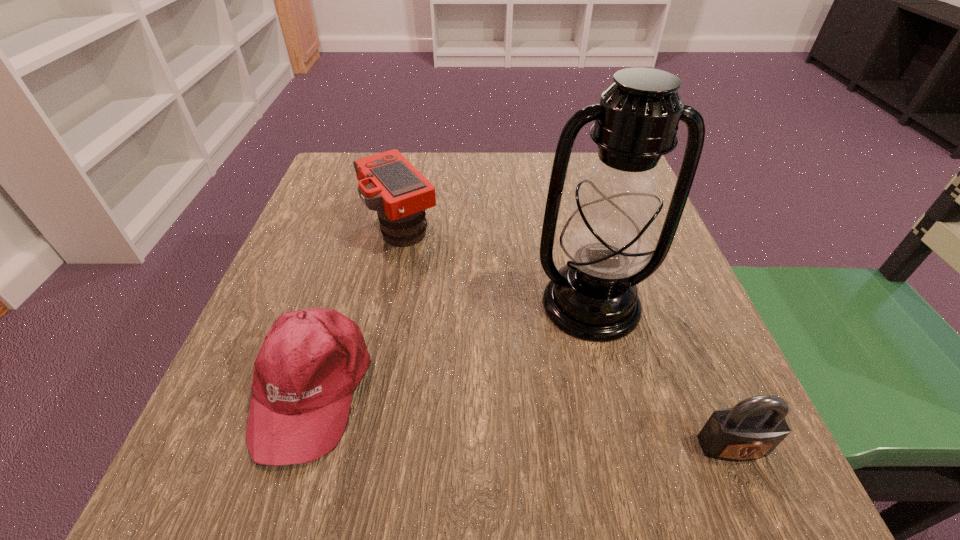
Where is `free space between the padlock and the camera`? The image size is (960, 540). free space between the padlock and the camera is located at coordinates point(566,338).

Find the location of a particular element. Image resolution: width=960 pixels, height=540 pixels. free space between the baseball cap and the farthest object is located at coordinates (356, 308).

I want to click on vacant area that lies between the padlock and the oil lamp, so click(661, 375).

The width and height of the screenshot is (960, 540). What are the coordinates of `the second closest object to the camera` in the screenshot? It's located at point(608,238).

Locate which object is the third closest to the farthest object. Please provide its 2D coordinates. Your answer should be formatted as a tuple, i.e. [(x, y)], where the tuple contains the x and y coordinates of a point satisfying the conditions above.

[(753, 428)]